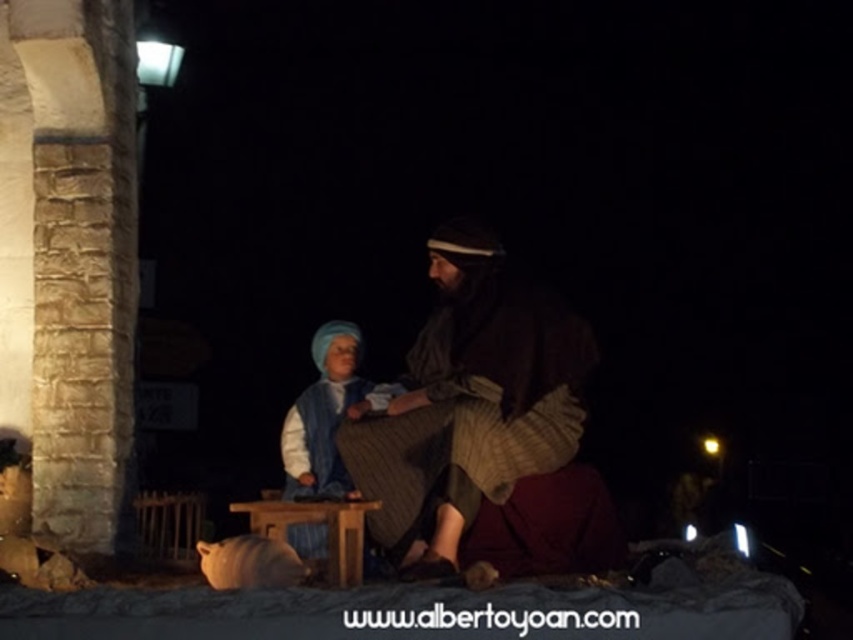
Question: Can you confirm if brown stone pillar at left is positioned below brown textured fabric at center?

Choices:
 (A) yes
 (B) no

Answer: (B)

Question: Does brown stone pillar at left appear on the left side of wooden stool at center?

Choices:
 (A) yes
 (B) no

Answer: (A)

Question: Which object is closer to the camera taking this photo?

Choices:
 (A) wooden stool at center
 (B) blue woolen scarf at center
 (C) brown textured fabric at center
 (D) brown stone pillar at left

Answer: (A)

Question: Which object is positioned closest to the blue woolen scarf at center?

Choices:
 (A) brown stone pillar at left
 (B) wooden stool at center
 (C) brown textured fabric at center

Answer: (B)

Question: Among these points, which one is nearest to the camera?

Choices:
 (A) (316, 394)
 (B) (277, 529)

Answer: (B)

Question: Can you confirm if brown stone pillar at left is thinner than blue woolen scarf at center?

Choices:
 (A) no
 (B) yes

Answer: (A)